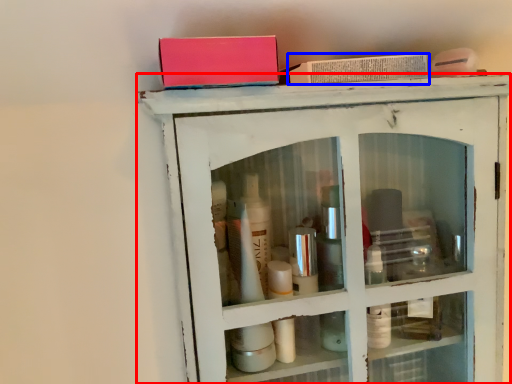
Question: Which point is further to the camera, shelf (highlighted by a red box) or book (highlighted by a blue box)?

Choices:
 (A) shelf
 (B) book

Answer: (B)